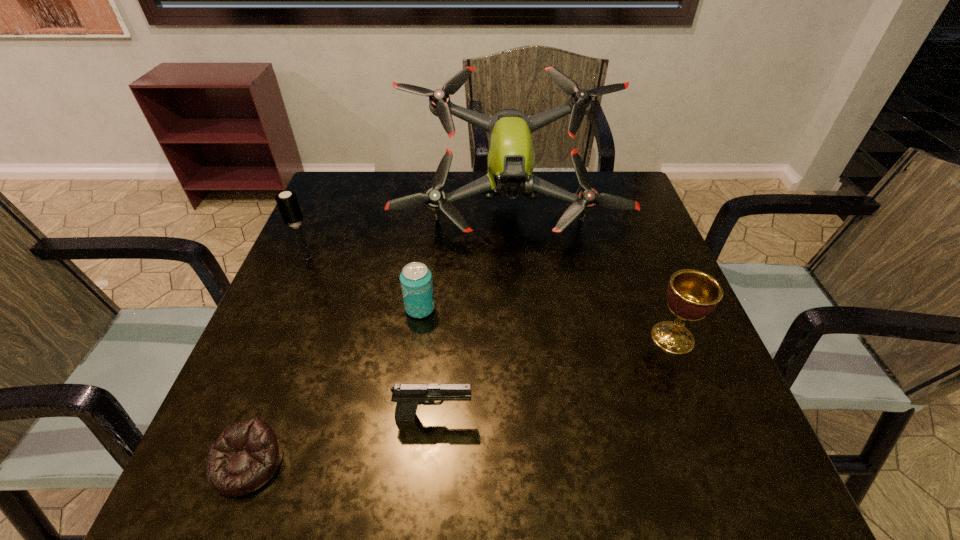
Where is `free spot located on the front of the fifth shortest object`? This screenshot has height=540, width=960. free spot located on the front of the fifth shortest object is located at coordinates (247, 398).

Find the location of `vacant space located 0.280m on the back of the chalice`. vacant space located 0.280m on the back of the chalice is located at coordinates 632,235.

Find the location of a particular element. vacant area situated on the left of the fourth nearest object is located at coordinates (338, 308).

In order to click on vacant space located 0.240m aim along the barrel of the second nearest object in this screenshot , I will do `click(613, 416)`.

Locate an element on the screen. The width and height of the screenshot is (960, 540). blank space located on the right of the beanbag is located at coordinates (384, 462).

Where is `object present at the far edge`? The height and width of the screenshot is (540, 960). object present at the far edge is located at coordinates (511, 159).

Where is `object situated at the near edge`? The image size is (960, 540). object situated at the near edge is located at coordinates (246, 455).

Where is `hairbrush that is at the left edge`? Image resolution: width=960 pixels, height=540 pixels. hairbrush that is at the left edge is located at coordinates (287, 202).

What are the coordinates of `beanbag that is at the left edge` in the screenshot? It's located at point(246,455).

Find the location of `drone at the right edge`. drone at the right edge is located at coordinates (511, 159).